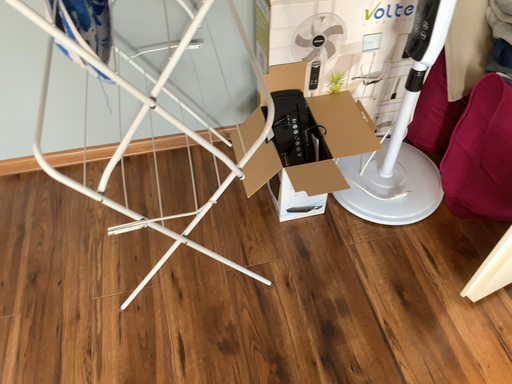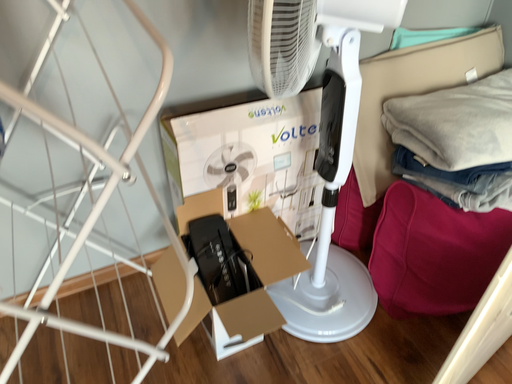
Question: How did the camera likely rotate when shooting the video?

Choices:
 (A) rotated left
 (B) rotated right

Answer: (B)